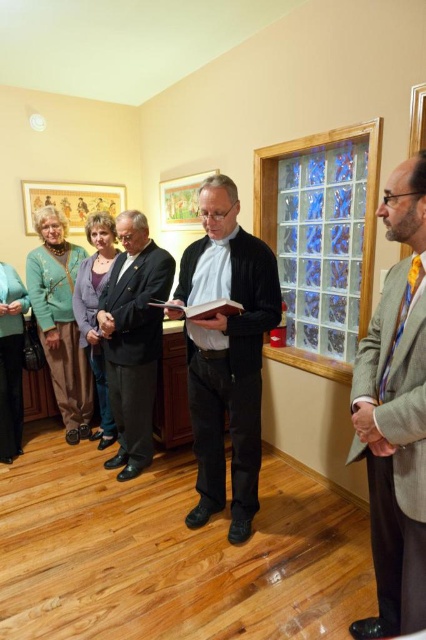
Question: Is gray wool suit at right above teal fabric scarf at left?

Choices:
 (A) no
 (B) yes

Answer: (A)

Question: Can you confirm if black matte sweater at center is positioned above teal fabric scarf at left?

Choices:
 (A) no
 (B) yes

Answer: (B)

Question: Which of the following is the closest to the observer?

Choices:
 (A) (43, 256)
 (B) (244, 371)
 (C) (6, 358)

Answer: (B)

Question: Does matte green sweater at left appear over teal fabric scarf at left?

Choices:
 (A) no
 (B) yes

Answer: (B)

Question: Which point is farther to the camera?

Choices:
 (A) (402, 435)
 (B) (123, 419)
 (C) (83, 353)
 (D) (17, 307)

Answer: (C)

Question: Estimate the real-world distances between objects in this image. Which object is closer to the black matte sweater at center?

Choices:
 (A) gray wool suit at right
 (B) teal fabric scarf at left
 (C) matte green sweater at left
 (D) black suit at center

Answer: (D)